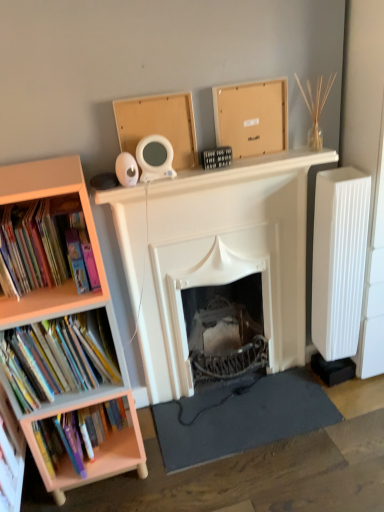
Locate an element on the screen. The height and width of the screenshot is (512, 384). empty space that is to the right of peach wood bookcase at left is located at coordinates (175, 476).